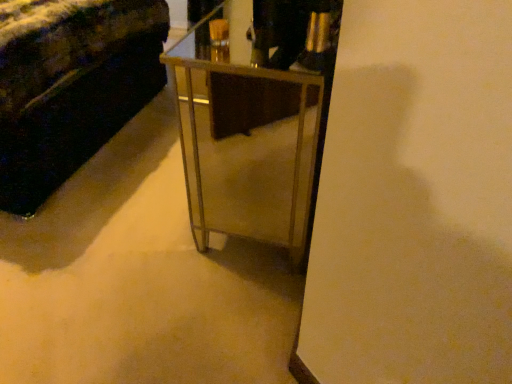
Question: Does metallic gold table at center come in front of velvet dark green couch at left?

Choices:
 (A) yes
 (B) no

Answer: (A)

Question: From the image's perspective, is metallic gold table at center located beneath velvet dark green couch at left?

Choices:
 (A) no
 (B) yes

Answer: (B)

Question: Does metallic gold table at center have a larger size compared to velvet dark green couch at left?

Choices:
 (A) yes
 (B) no

Answer: (B)

Question: Would you consider metallic gold table at center to be distant from velvet dark green couch at left?

Choices:
 (A) yes
 (B) no

Answer: (B)

Question: Considering the relative sizes of metallic gold table at center and velvet dark green couch at left in the image provided, is metallic gold table at center smaller than velvet dark green couch at left?

Choices:
 (A) yes
 (B) no

Answer: (A)

Question: Considering the relative sizes of metallic gold table at center and velvet dark green couch at left in the image provided, is metallic gold table at center thinner than velvet dark green couch at left?

Choices:
 (A) no
 (B) yes

Answer: (B)

Question: Is velvet dark green couch at left positioned beyond the bounds of metallic gold table at center?

Choices:
 (A) yes
 (B) no

Answer: (A)

Question: Considering the relative sizes of velvet dark green couch at left and metallic gold table at center in the image provided, is velvet dark green couch at left smaller than metallic gold table at center?

Choices:
 (A) no
 (B) yes

Answer: (A)

Question: Could you tell me if velvet dark green couch at left is turned towards metallic gold table at center?

Choices:
 (A) yes
 (B) no

Answer: (A)

Question: Is velvet dark green couch at left looking in the opposite direction of metallic gold table at center?

Choices:
 (A) yes
 (B) no

Answer: (B)

Question: Can you see velvet dark green couch at left touching metallic gold table at center?

Choices:
 (A) yes
 (B) no

Answer: (B)

Question: From a real-world perspective, is velvet dark green couch at left under metallic gold table at center?

Choices:
 (A) no
 (B) yes

Answer: (A)

Question: Looking at the image, does metallic gold table at center seem bigger or smaller compared to velvet dark green couch at left?

Choices:
 (A) small
 (B) big

Answer: (A)